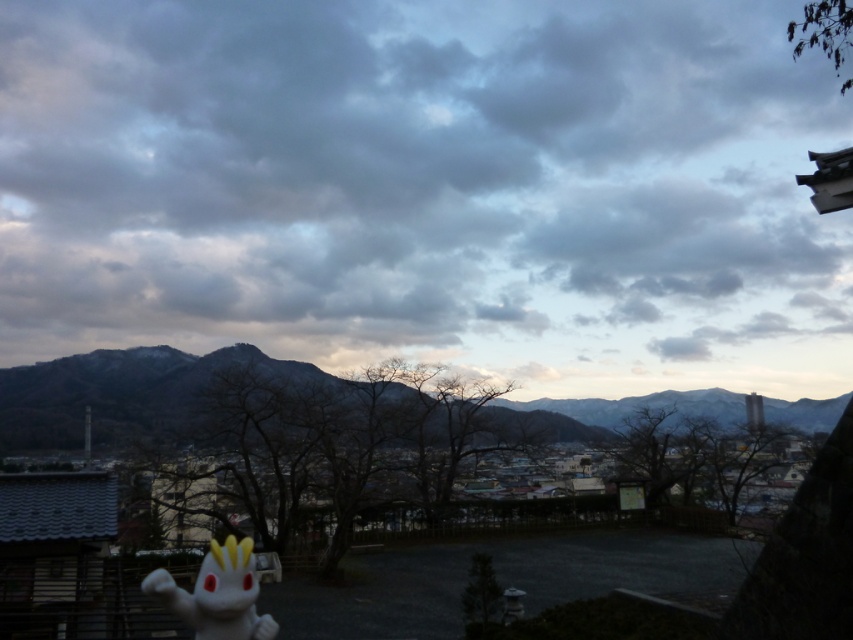
Consider the image. You are an artist trying to paint the scene. You have a limited amount of paint for the matte gray dusk at center and the rocky brown mountain at center. Given their sizes, which object will require more paint?

The matte gray dusk at center requires more paint because it is larger in size than the rocky brown mountain at center.

You are an artist planning to paint the scene. You want to ensure that the matte gray dusk at center and the rocky brown mountain at center are proportionally accurate. Which object should you make wider in your painting?

The matte gray dusk at center should be made wider in the painting since its width surpasses that of the rocky brown mountain at center according to the description.